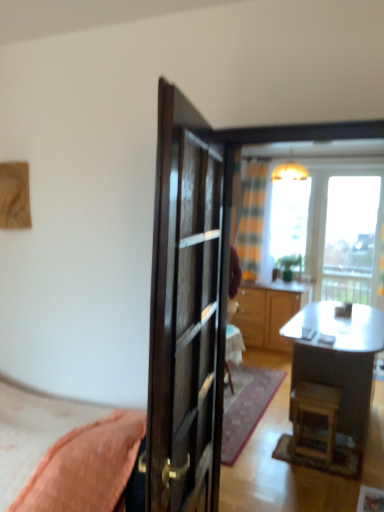
Question: Is wooden stool at lower right located outside transparent glass window at upper center?

Choices:
 (A) yes
 (B) no

Answer: (A)

Question: From the image's perspective, does wooden stool at lower right appear lower than transparent glass window at upper center?

Choices:
 (A) no
 (B) yes

Answer: (B)

Question: Are wooden stool at lower right and transparent glass window at upper center far apart?

Choices:
 (A) yes
 (B) no

Answer: (A)

Question: Is the depth of wooden stool at lower right less than that of transparent glass window at upper center?

Choices:
 (A) no
 (B) yes

Answer: (B)

Question: Is wooden stool at lower right shorter than transparent glass window at upper center?

Choices:
 (A) yes
 (B) no

Answer: (A)

Question: From a real-world perspective, is wooden stool at lower right positioned under transparent glass window at upper center based on gravity?

Choices:
 (A) yes
 (B) no

Answer: (A)

Question: Are wooden stool at lower right and wooden cabinet at center far apart?

Choices:
 (A) no
 (B) yes

Answer: (B)

Question: From the image's perspective, is wooden stool at lower right on top of wooden cabinet at center?

Choices:
 (A) yes
 (B) no

Answer: (B)

Question: From the image's perspective, does wooden stool at lower right appear lower than wooden cabinet at center?

Choices:
 (A) no
 (B) yes

Answer: (B)

Question: Is the surface of wooden stool at lower right in direct contact with wooden cabinet at center?

Choices:
 (A) no
 (B) yes

Answer: (A)

Question: Is the position of wooden stool at lower right less distant than that of wooden cabinet at center?

Choices:
 (A) no
 (B) yes

Answer: (B)

Question: Considering the relative sizes of wooden stool at lower right and wooden cabinet at center in the image provided, is wooden stool at lower right wider than wooden cabinet at center?

Choices:
 (A) yes
 (B) no

Answer: (B)

Question: From the image's perspective, is metallic silver desk at center below wooden stool at lower right?

Choices:
 (A) no
 (B) yes

Answer: (A)